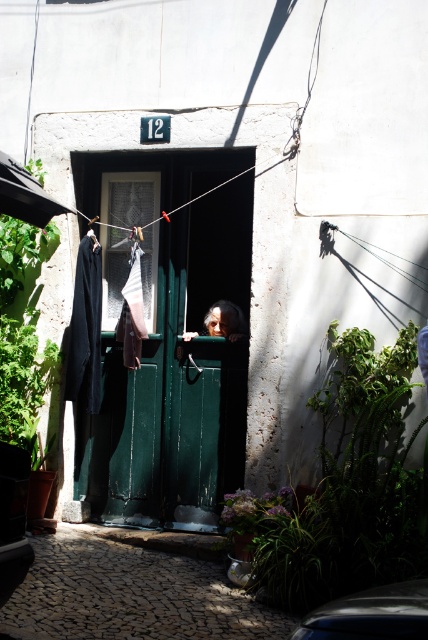
You are standing in a narrow cobblestone alley at lower center and need to reach a nearby park entrance located 5 meters away. Can you walk straight ahead without needing to turn?

The distance between the cobblestone alley at lower center and the viewer is 4.15 meters. Since the park entrance is 5 meters away, you can walk straight ahead as the distance is sufficient.

You are standing at the entrance of the residential area and want to locate two specific points marked on a map. The first point is at coordinates point (70, 323) and the second point is at point (127, 294). Which point is closer to you when you are facing the green wooden door?

Point (127, 294) is closer to you because it is in front of point (70, 323), which is behind it.

You are a delivery person trying to navigate through the cobblestone alley at lower center while avoiding the smooth skin face at center. Which path should you choose to ensure you can pass through without obstruction?

The cobblestone alley at lower center is larger in size than the smooth skin face at center, so you should choose the path through the cobblestone alley at lower center as it provides more space to navigate safely.